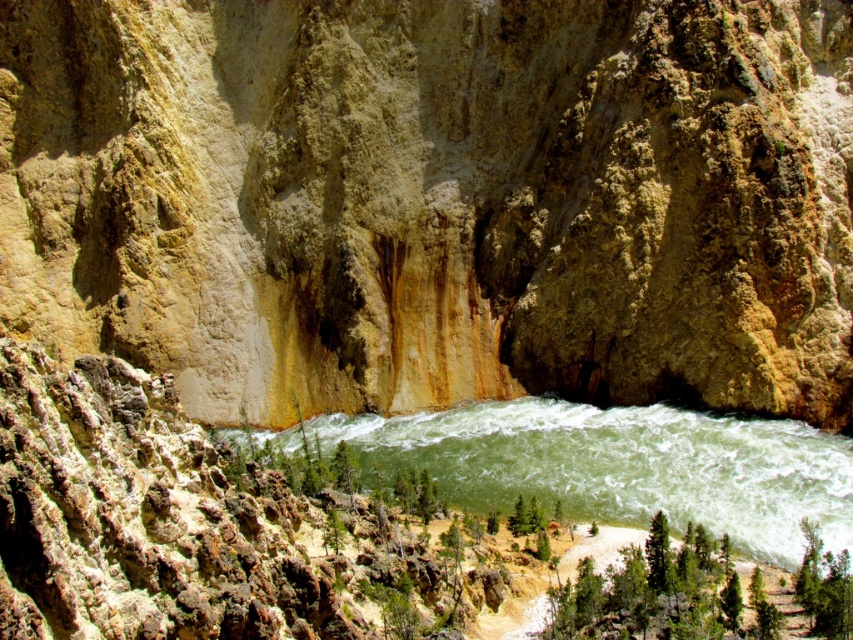
Who is higher up, green smooth water at center or green leafy tree at lower center?

green smooth water at center is above.

Is green smooth water at center positioned in front of green leafy tree at lower center?

Yes.

Is point (576, 452) positioned after point (521, 531)?

Yes, point (576, 452) is behind point (521, 531).

Find the location of a particular element. The image size is (853, 640). green smooth water at center is located at coordinates (621, 465).